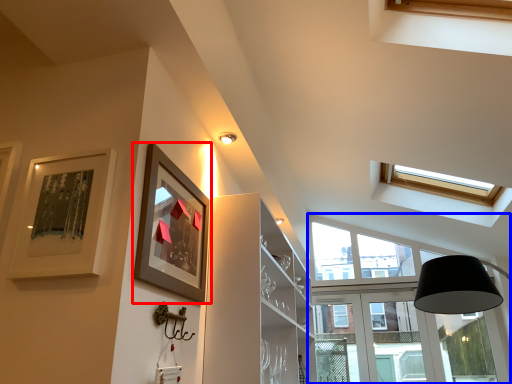
Question: Which point is further to the camera, picture frame (highlighted by a red box) or window (highlighted by a blue box)?

Choices:
 (A) picture frame
 (B) window

Answer: (B)